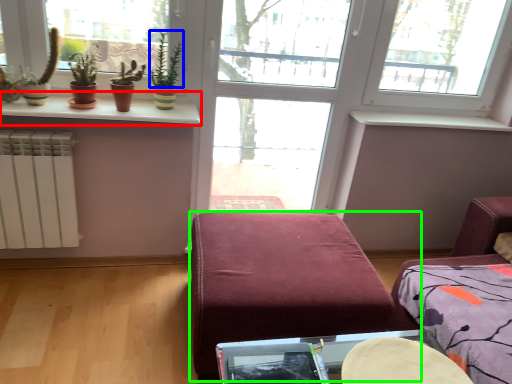
Question: Based on their relative distances, which object is nearer to window sill (highlighted by a red box)? Choose from plant (highlighted by a blue box) and furniture (highlighted by a green box).

Choices:
 (A) plant
 (B) furniture

Answer: (A)